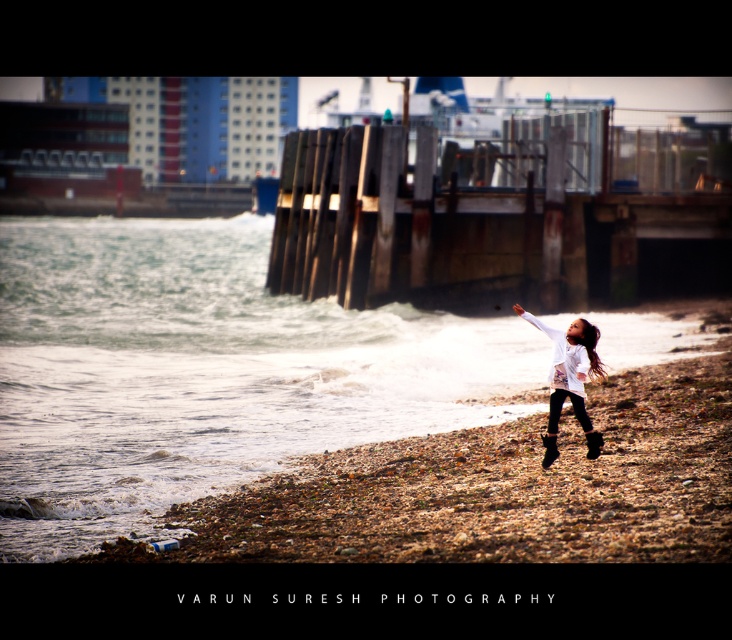
Question: Is rusty wood dock at center behind white matte jacket at lower right?

Choices:
 (A) yes
 (B) no

Answer: (A)

Question: Which of the following is the farthest from the observer?

Choices:
 (A) (478, 189)
 (B) (563, 349)

Answer: (A)

Question: Does rusty wood dock at center have a greater width compared to white matte jacket at lower right?

Choices:
 (A) no
 (B) yes

Answer: (B)

Question: Does rusty wood dock at center lie in front of white matte jacket at lower right?

Choices:
 (A) yes
 (B) no

Answer: (B)